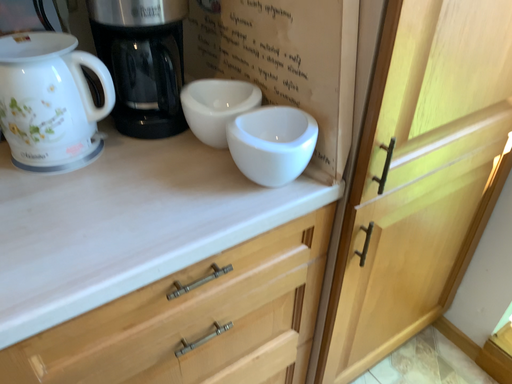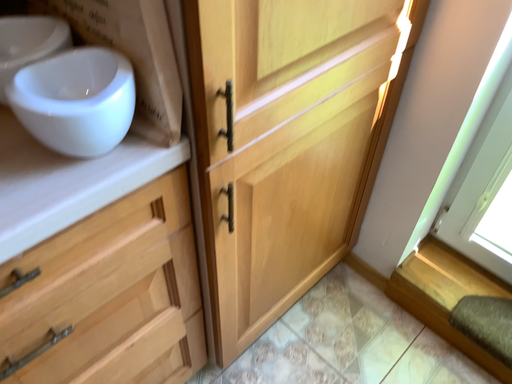
Question: How did the camera likely rotate when shooting the video?

Choices:
 (A) rotated left
 (B) rotated right

Answer: (B)